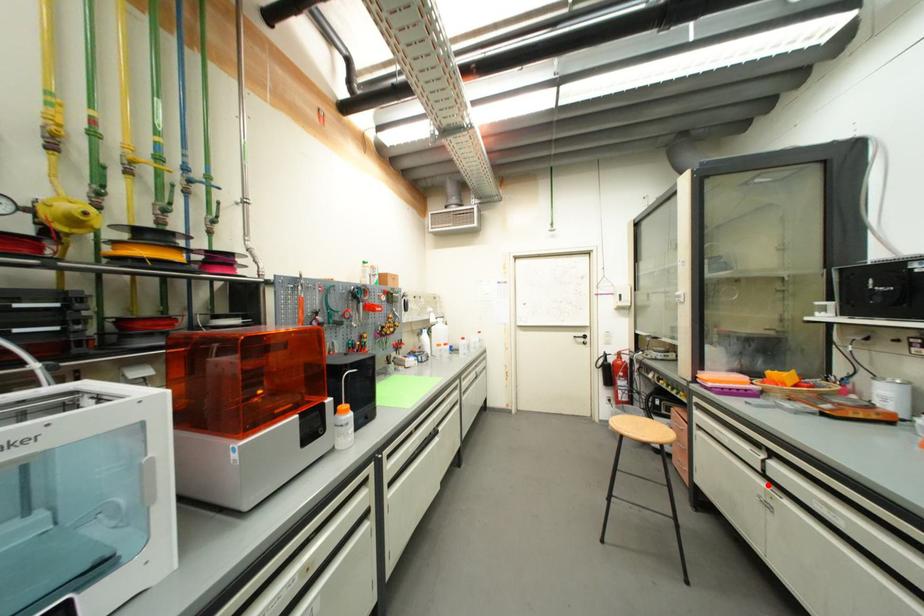
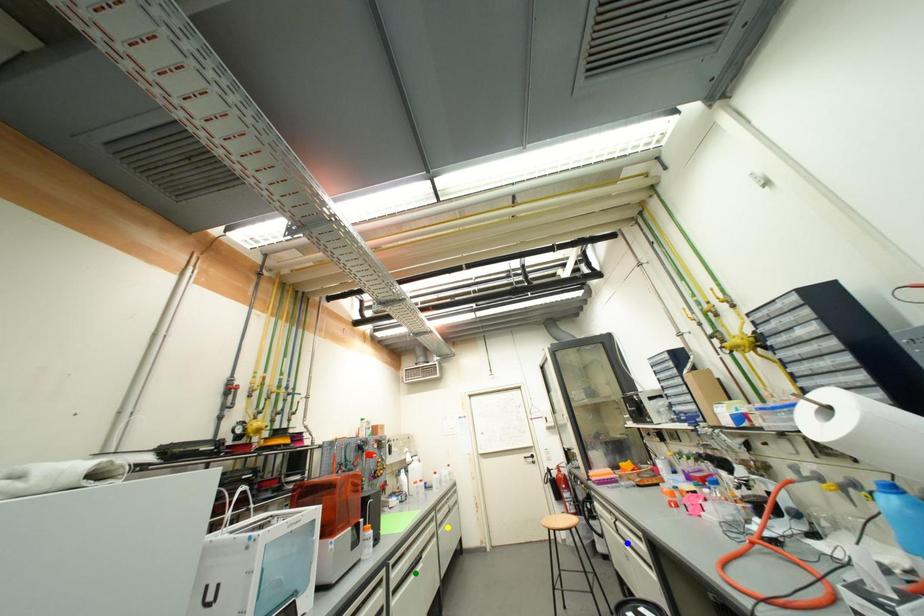
Question: I am providing you with two images of the same scene from different viewpoints. A red point is marked on the first image. You are given multiple points on the second image. In image 2, which mark is for the same physical point as the one in image 1?

Choices:
 (A) blue point
 (B) yellow point
 (C) green point

Answer: (A)